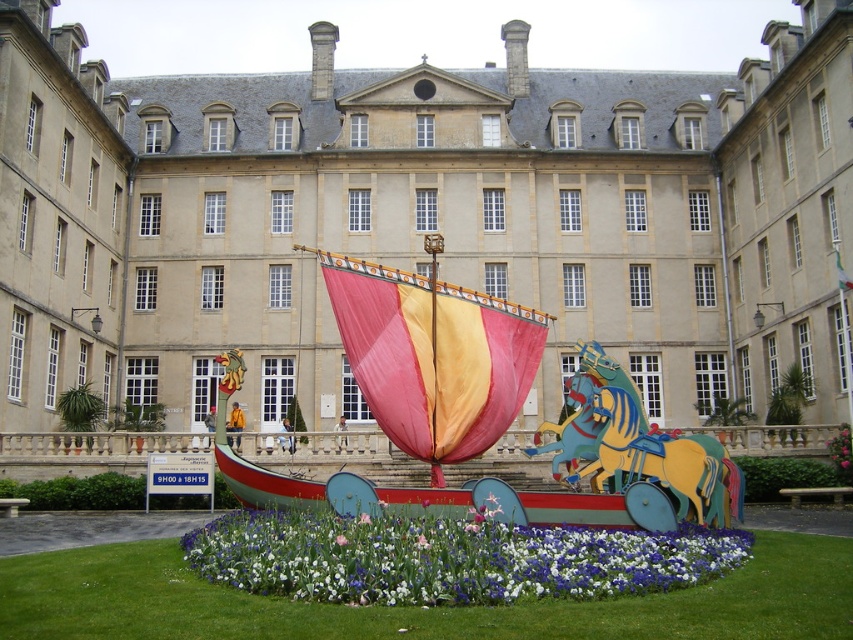
Question: Does multicolored fabric boat at center have a larger size compared to vivid floral carpet at center?

Choices:
 (A) no
 (B) yes

Answer: (B)

Question: Can you confirm if purple fabric flower at center is wider than pink fabric flower at center?

Choices:
 (A) no
 (B) yes

Answer: (B)

Question: Which point is farther to the camera?

Choices:
 (A) multicolored fabric boat at center
 (B) pink fabric flower at center
 (C) purple fabric flower at center

Answer: (A)

Question: Which point is closer to the camera taking this photo?

Choices:
 (A) (466, 291)
 (B) (727, 545)
 (C) (339, 541)
 (D) (366, 518)

Answer: (C)

Question: Is multicolored fabric boat at center above vivid floral carpet at center?

Choices:
 (A) yes
 (B) no

Answer: (A)

Question: Estimate the real-world distances between objects in this image. Which object is closer to the pink fabric flower at center?

Choices:
 (A) vivid floral carpet at center
 (B) green grass at center
 (C) purple fabric flower at center
 (D) multicolored fabric boat at center

Answer: (C)